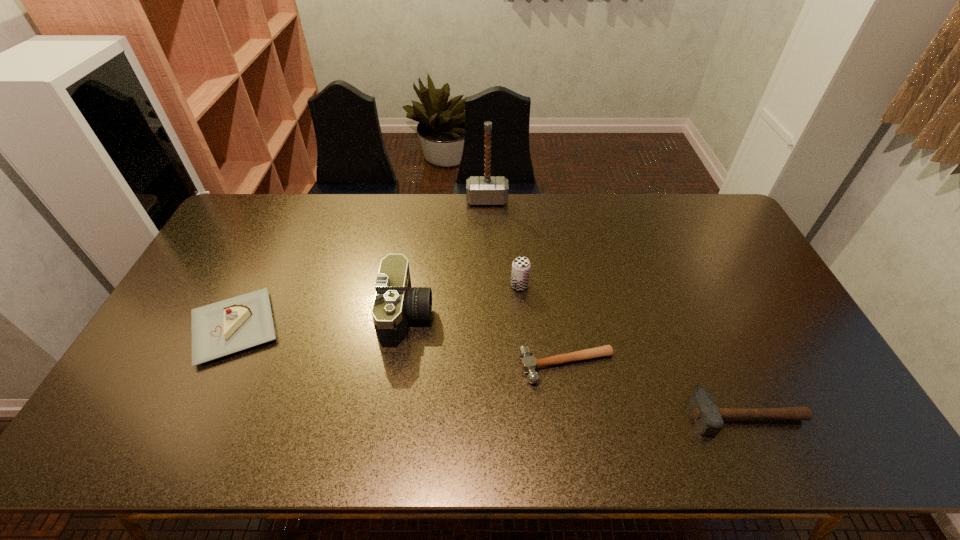
Locate an element on the screen. The height and width of the screenshot is (540, 960). the shortest object is located at coordinates (529, 363).

Identify the location of vacant area situated on the striking surface of the farthest object. (488, 261).

Locate an element on the screen. The image size is (960, 540). vacant region located on the front-facing side of the second object from left to right is located at coordinates (552, 316).

You are a GUI agent. You are given a task and a screenshot of the screen. Output one action in this format:
    pyautogui.click(x=<x>, y=<y>)
    Task: Click on the vacant space located 0.100m on the back of the beer can
    This screenshot has height=540, width=960.
    Given the screenshot: What is the action you would take?
    pos(517,258)

Where is `free space located 0.090m on the back of the cake`? The height and width of the screenshot is (540, 960). free space located 0.090m on the back of the cake is located at coordinates (262, 271).

Find the location of a particular element. The width and height of the screenshot is (960, 540). free space located on the right of the shortest hammer is located at coordinates point(739,366).

I want to click on object that is at the far edge, so click(x=480, y=190).

Identify the location of object located in the near edge section of the desktop. (708, 417).

Find the location of a particular element. The height and width of the screenshot is (540, 960). object located in the left edge section of the desktop is located at coordinates (235, 324).

Where is `object that is positioned at the right edge`? The width and height of the screenshot is (960, 540). object that is positioned at the right edge is located at coordinates (708, 417).